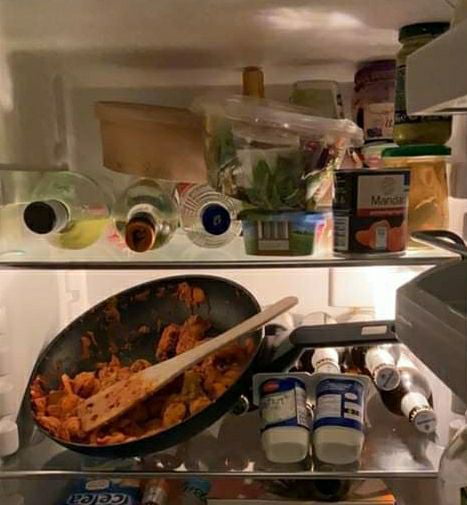
Where is `middle shelf`? This screenshot has height=505, width=467. middle shelf is located at coordinates (48, 318).